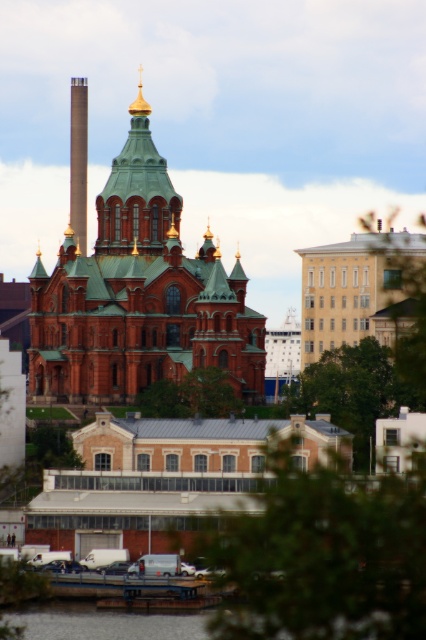
Based on the provided scene description, where is the green leafy tree at lower center located in terms of its 2D coordinates?

The green leafy tree at lower center is located at the 2D coordinates of point (321, 554).

You are standing at the point with coordinates point (135, 285) in the image. What object are you directly facing?

The point (135, 285) corresponds to the green copper dome at center, so you are directly facing the green copper dome at center.

Consider the image. You are standing at the point labeled as point [321,554] in the image. What object is located at this point?

The point [321,554] indicates a green leafy tree at lower center.